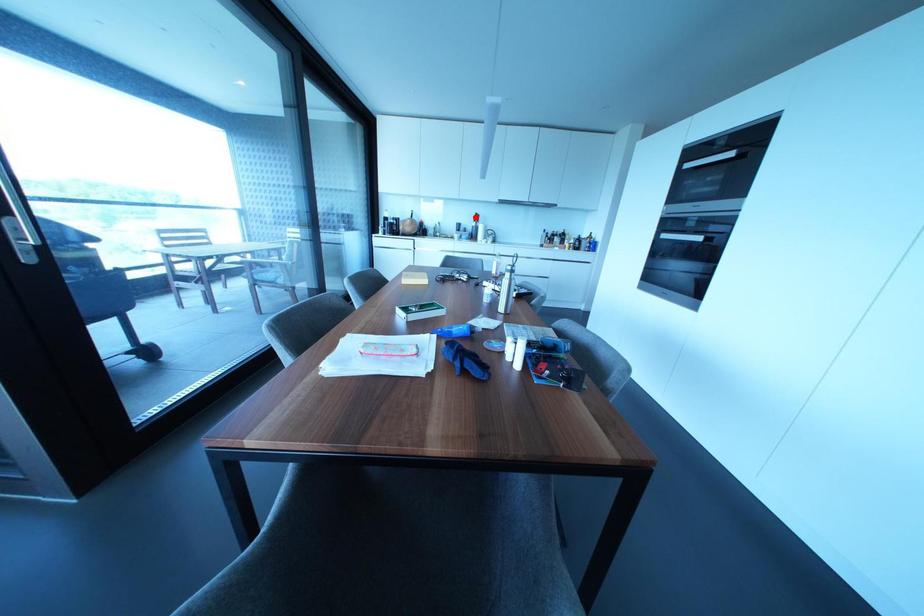
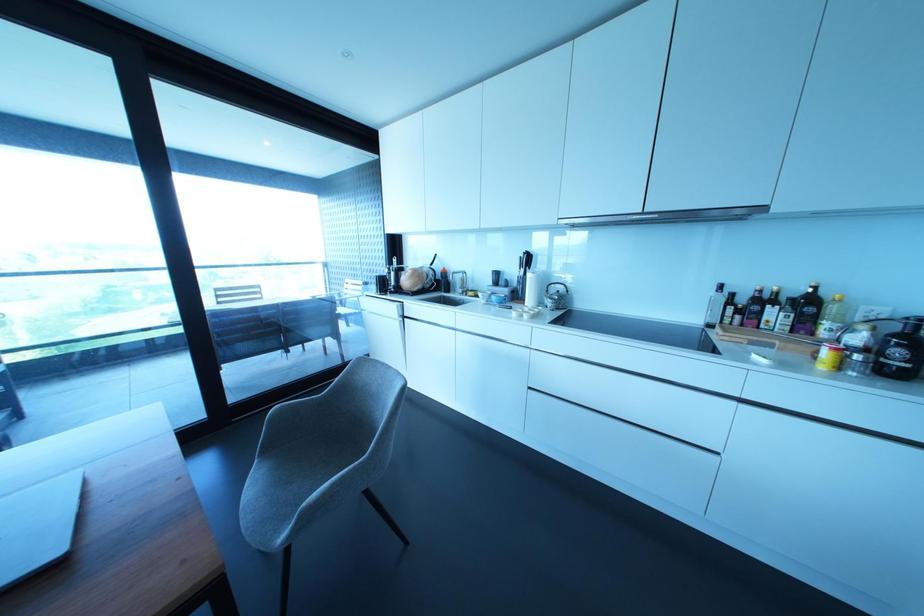
In the second image, find the point that corresponds to the highlighted location in the first image.

(527, 259)